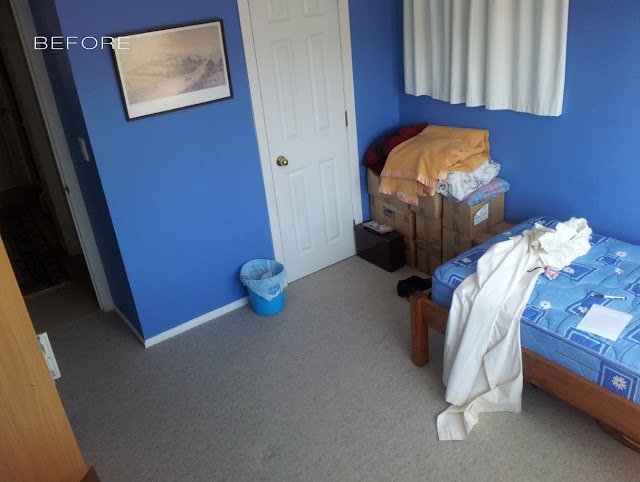
Find the location of a particular element. The width and height of the screenshot is (640, 482). blankets is located at coordinates (440, 154), (457, 187), (468, 200).